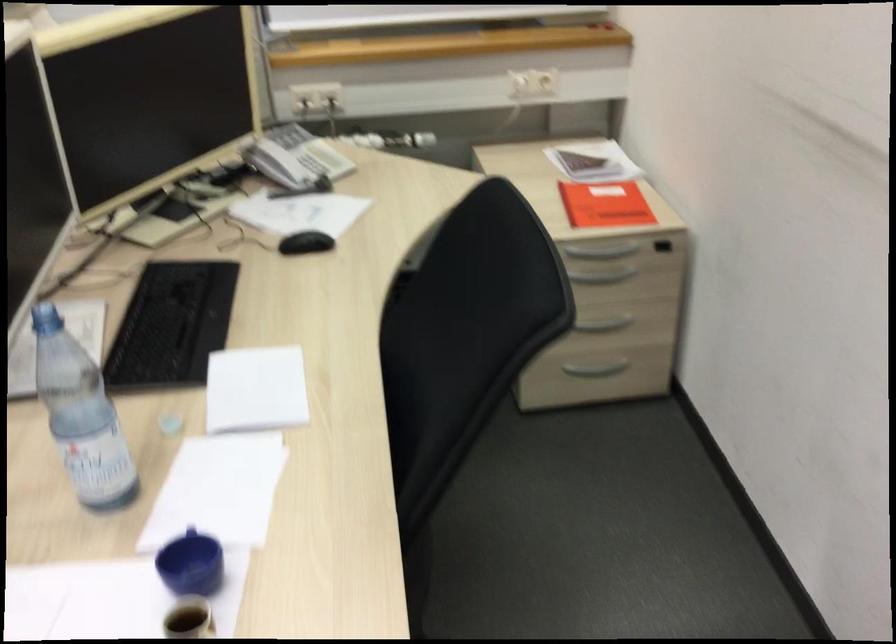
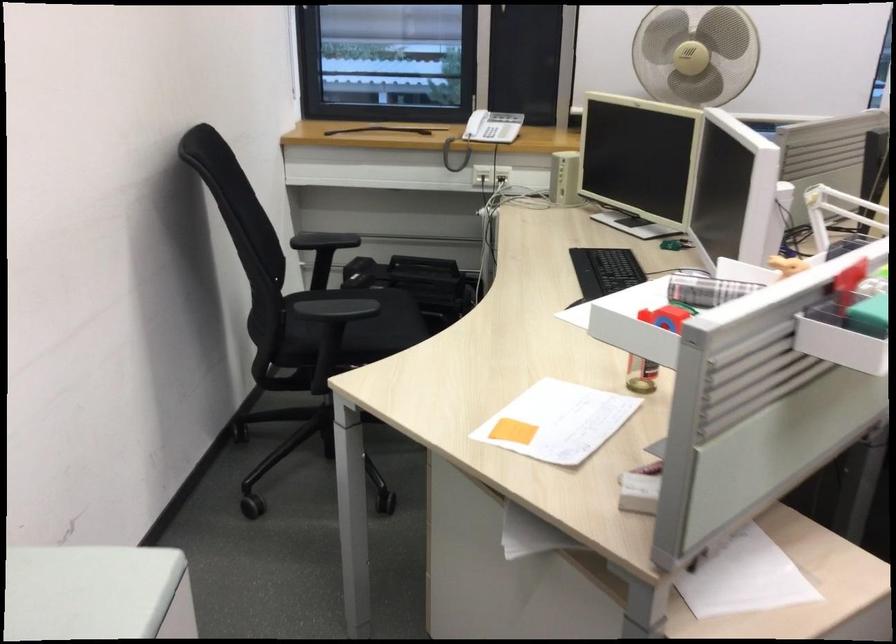
Question: What movement of the cameraman would produce the second image?

Choices:
 (A) Left
 (B) Right
 (C) Forward
 (D) Backward

Answer: (A)